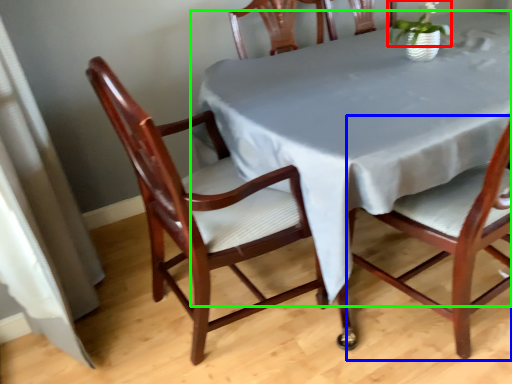
Question: Which is farther away from plant (highlighted by a red box)? chair (highlighted by a blue box) or table (highlighted by a green box)?

Choices:
 (A) chair
 (B) table

Answer: (A)